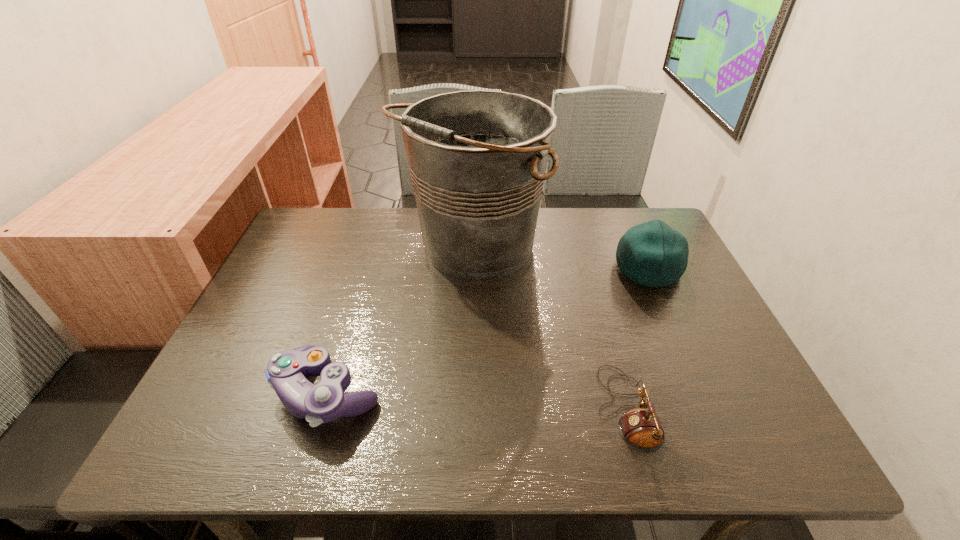
Where is `the tallest object`? Image resolution: width=960 pixels, height=540 pixels. the tallest object is located at coordinates (478, 158).

Where is `the third shortest object`? The height and width of the screenshot is (540, 960). the third shortest object is located at coordinates (653, 254).

At what (x,y) coordinates should I click in order to perform the action: click on beanie. Please return your answer as a coordinate pair (x, y). Looking at the image, I should click on (653, 254).

At what (x,y) coordinates should I click in order to perform the action: click on control. Please return your answer as a coordinate pair (x, y). The image size is (960, 540). Looking at the image, I should click on (286, 373).

What are the coordinates of `the third object from left to right` in the screenshot? It's located at (641, 429).

Image resolution: width=960 pixels, height=540 pixels. Find the location of `the shortest object`. the shortest object is located at coordinates (641, 429).

Identify the location of free space located 0.210m on the front of the tallest object. Image resolution: width=960 pixels, height=540 pixels. (469, 366).

Locate an element on the screen. vacant area situated on the left of the third shortest object is located at coordinates (592, 268).

You are a GUI agent. You are given a task and a screenshot of the screen. Output one action in this format:
    pyautogui.click(x=<x>, y=<y>)
    Task: Click on the blank area located on the left of the second shortest object
    
    Given the screenshot: What is the action you would take?
    pyautogui.click(x=202, y=393)

Find the location of `free space located on the rotary dial of the third object from left to right`. free space located on the rotary dial of the third object from left to right is located at coordinates (512, 408).